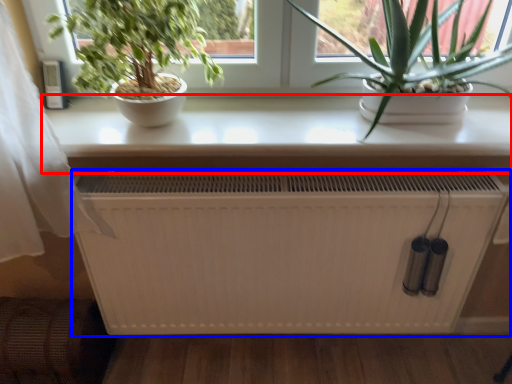
Question: Which of the following is the farthest to the observer, table (highlighted by a red box) or heater (highlighted by a blue box)?

Choices:
 (A) table
 (B) heater

Answer: (B)